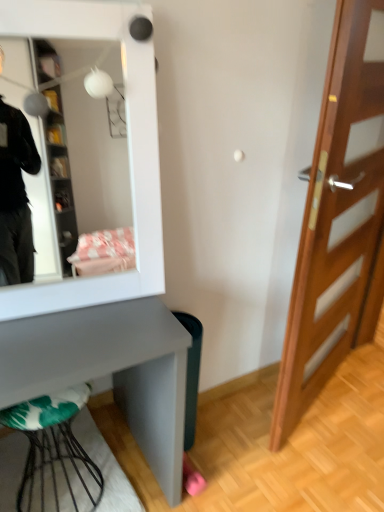
Find the location of a particular element. The image size is (384, 512). unoccupied area in front of green plastic trash bin at lower right is located at coordinates (204, 469).